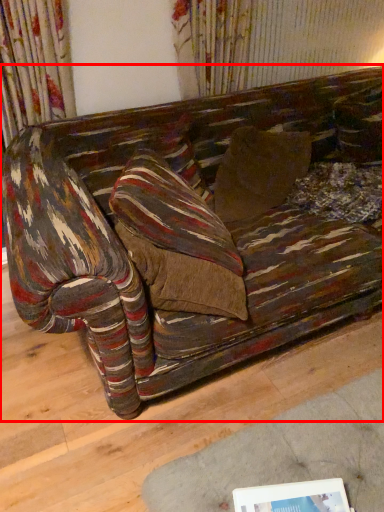
Question: Considering the relative positions of studio couch (annotated by the red box) and picture frame in the image provided, where is studio couch (annotated by the red box) located with respect to the staircase?

Choices:
 (A) right
 (B) left

Answer: (A)